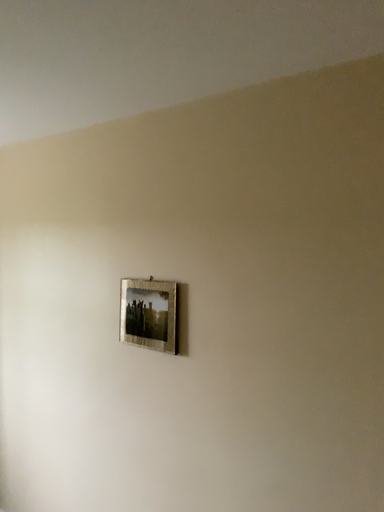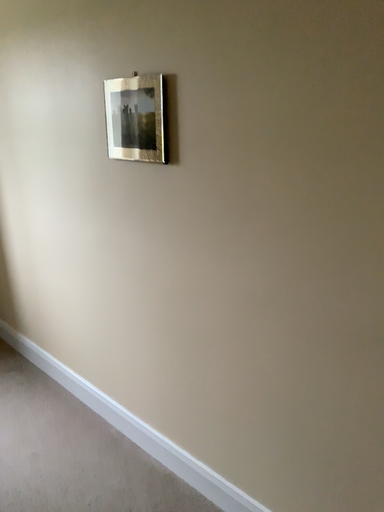
Question: Which way did the camera rotate in the video?

Choices:
 (A) rotated upward
 (B) rotated downward

Answer: (B)